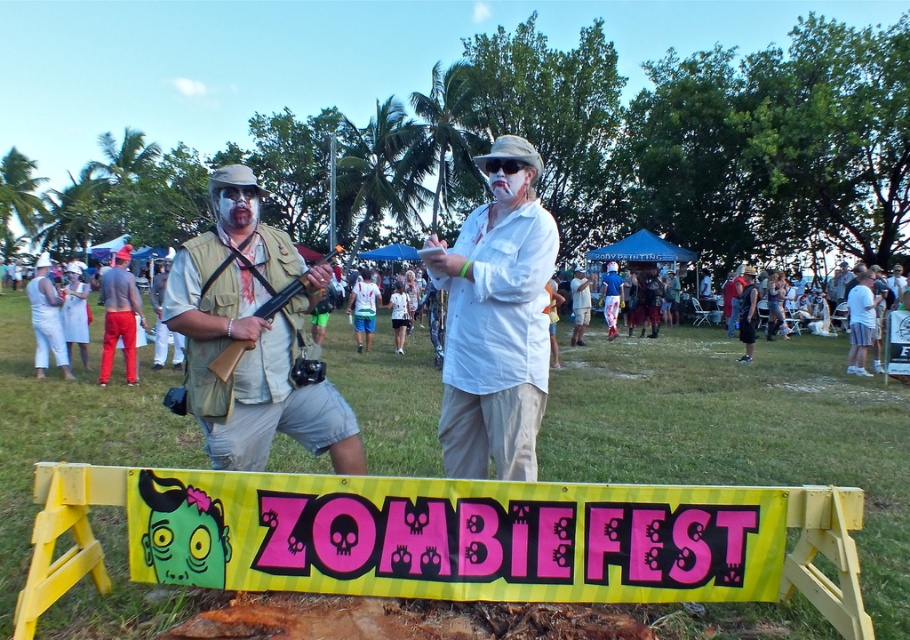
Is white matte shirt at center thinner than yellow plastic banner at center?

Incorrect, white matte shirt at center's width is not less than yellow plastic banner at center's.

Between point (466, 369) and point (110, 474), which one is positioned in front?

Positioned in front is point (110, 474).

Where is `white matte shirt at center`? This screenshot has height=640, width=910. white matte shirt at center is located at coordinates (496, 321).

Which is above, matte khaki vest at left or white matte shirt at center?

white matte shirt at center is above.

Which is in front, point (292, 308) or point (509, 365)?

Point (509, 365)

What do you see at coordinates (253, 337) in the screenshot? Image resolution: width=910 pixels, height=640 pixels. I see `matte khaki vest at left` at bounding box center [253, 337].

Find the location of a particular element. The height and width of the screenshot is (640, 910). matte khaki vest at left is located at coordinates (253, 337).

Is point (194, 268) in front of point (52, 563)?

That is False.

Which is more to the right, matte khaki vest at left or yellow plastic banner at center?

yellow plastic banner at center

The image size is (910, 640). In order to click on matte khaki vest at left in this screenshot , I will do `click(253, 337)`.